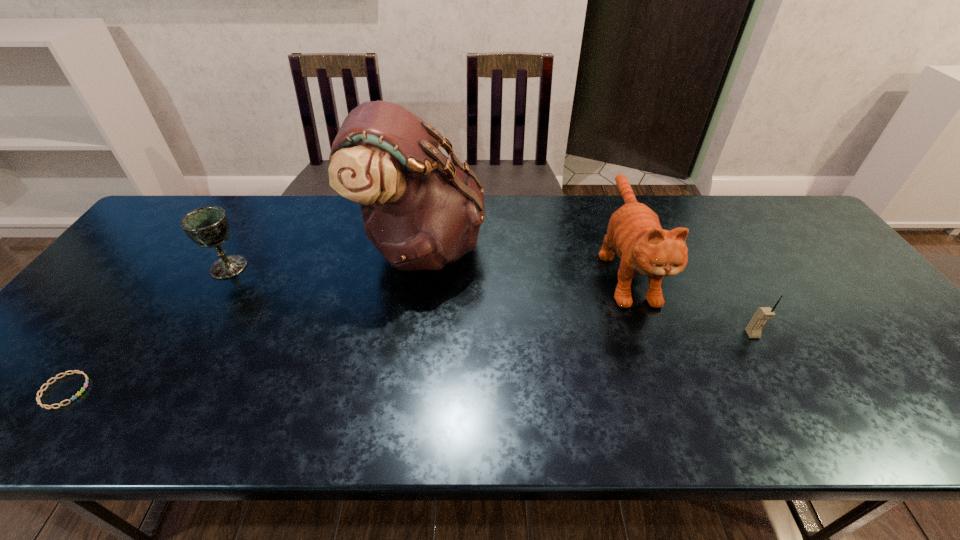
Locate an element on the screen. The height and width of the screenshot is (540, 960). satchel is located at coordinates (421, 210).

Image resolution: width=960 pixels, height=540 pixels. Find the location of `the tallest object`. the tallest object is located at coordinates (421, 210).

Where is `cat`? The height and width of the screenshot is (540, 960). cat is located at coordinates (634, 230).

Where is `the fourth shortest object`? This screenshot has width=960, height=540. the fourth shortest object is located at coordinates (634, 230).

This screenshot has height=540, width=960. Identify the location of the fourth object from right to left. (208, 226).

Find the location of a particular element. the third shortest object is located at coordinates (208, 226).

Locate an element on the screen. the fourth tallest object is located at coordinates (754, 328).

At what (x,y) coordinates should I click in order to perform the action: click on the rightmost object. Please return your answer as a coordinate pair (x, y). The width and height of the screenshot is (960, 540). Looking at the image, I should click on (754, 328).

In order to click on the nearest object in this screenshot , I will do `click(78, 372)`.

Identify the location of the shortest object. (78, 372).